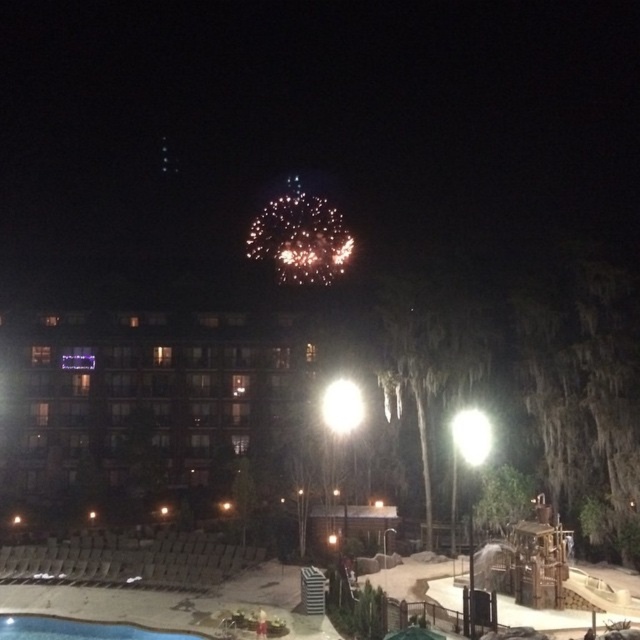
Question: Which point is farther to the camera?

Choices:
 (A) (113, 625)
 (B) (154, 483)

Answer: (B)

Question: Can you confirm if matte glass hotel at center is thinner than blue smooth pool at lower left?

Choices:
 (A) yes
 (B) no

Answer: (B)

Question: Does matte glass hotel at center lie behind blue smooth pool at lower left?

Choices:
 (A) yes
 (B) no

Answer: (A)

Question: Does matte glass hotel at center appear on the right side of blue smooth pool at lower left?

Choices:
 (A) yes
 (B) no

Answer: (B)